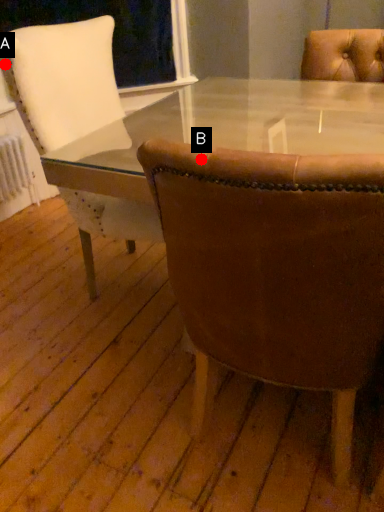
Question: Two points are circled on the image, labeled by A and B beside each circle. Which point is farther from the camera taking this photo?

Choices:
 (A) A is further
 (B) B is further

Answer: (A)